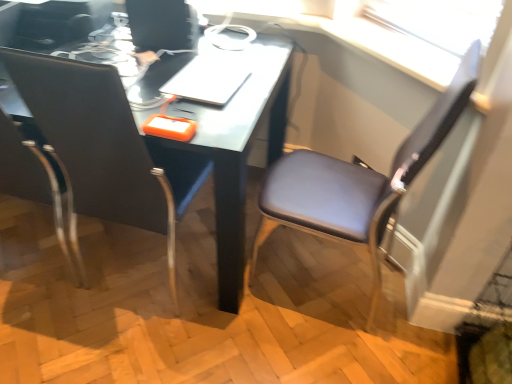
At what (x,y) coordinates should I click in order to perform the action: click on unoccupied area in front of matte black chair at right, the 1th chair when ordered from right to left. Please return your answer as a coordinate pair (x, y). Looking at the image, I should click on tap(322, 349).